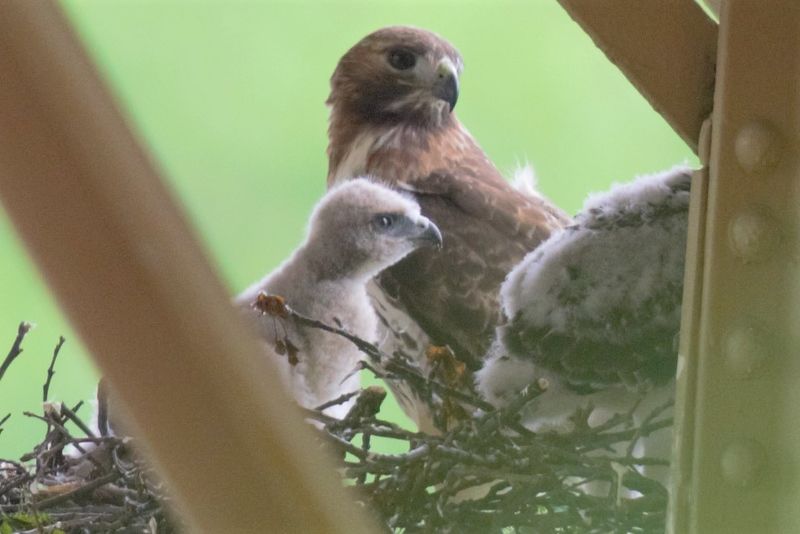
The image size is (800, 534). I want to click on beams, so click(x=689, y=80), click(x=756, y=91), click(x=181, y=372).